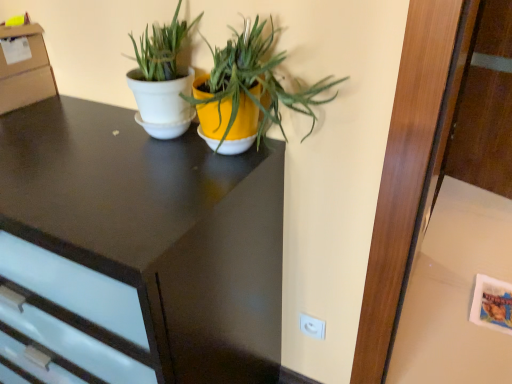
Question: Should I look upward or downward to see white glossy pot at center, marked as the second houseplant in a right-to-left arrangement?

Choices:
 (A) down
 (B) up

Answer: (B)

Question: Does white glossy pot at center, marked as the second houseplant in a right-to-left arrangement, come in front of white glossy table at lower right?

Choices:
 (A) no
 (B) yes

Answer: (B)

Question: Can you confirm if white glossy pot at center, marked as the second houseplant in a right-to-left arrangement, is shorter than white glossy table at lower right?

Choices:
 (A) no
 (B) yes

Answer: (A)

Question: From the image's perspective, is white glossy pot at center, marked as the second houseplant in a right-to-left arrangement, above white glossy table at lower right?

Choices:
 (A) yes
 (B) no

Answer: (A)

Question: Is white glossy pot at center, marked as the second houseplant in a right-to-left arrangement, oriented away from white glossy table at lower right?

Choices:
 (A) yes
 (B) no

Answer: (B)

Question: Is white glossy pot at center, which is the 1th houseplant from left to right, positioned beyond the bounds of white glossy table at lower right?

Choices:
 (A) yes
 (B) no

Answer: (A)

Question: Considering the relative sizes of white glossy pot at center, which is the 1th houseplant from left to right, and white glossy table at lower right in the image provided, is white glossy pot at center, which is the 1th houseplant from left to right, thinner than white glossy table at lower right?

Choices:
 (A) yes
 (B) no

Answer: (A)

Question: Is matte black desk at center aimed at white plastic electric outlet at lower right?

Choices:
 (A) no
 (B) yes

Answer: (A)

Question: Does matte black desk at center have a lesser height compared to white plastic electric outlet at lower right?

Choices:
 (A) no
 (B) yes

Answer: (A)

Question: From the image's perspective, would you say matte black desk at center is positioned over white plastic electric outlet at lower right?

Choices:
 (A) yes
 (B) no

Answer: (A)

Question: Can you confirm if matte black desk at center is taller than white plastic electric outlet at lower right?

Choices:
 (A) yes
 (B) no

Answer: (A)

Question: Is matte black desk at center oriented away from white plastic electric outlet at lower right?

Choices:
 (A) no
 (B) yes

Answer: (A)

Question: Does matte black desk at center come in front of white plastic electric outlet at lower right?

Choices:
 (A) no
 (B) yes

Answer: (B)

Question: Is white glossy pot at center, marked as the second houseplant in a right-to-left arrangement, bigger than white glossy pot at center, the first houseplant from the right?

Choices:
 (A) yes
 (B) no

Answer: (B)